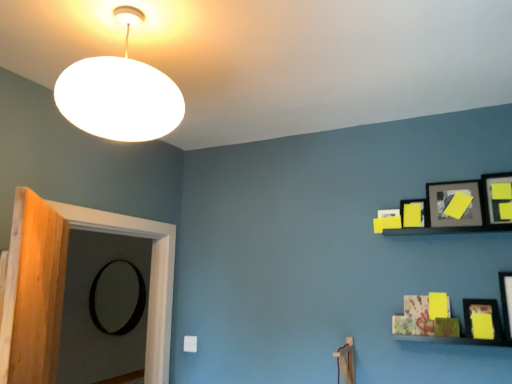
Question: Based on their positions, is wooden door at left located to the left or right of yellow matte picture frame at upper right, the 1th picture frame when ordered from top to bottom?

Choices:
 (A) left
 (B) right

Answer: (A)

Question: Considering their positions, is wooden door at left located in front of or behind yellow matte picture frame at upper right, acting as the 4th picture frame starting from the back?

Choices:
 (A) behind
 (B) front

Answer: (B)

Question: Which of these objects is positioned farthest from the black matte picture frame at left, the 6th picture frame viewed from the top?

Choices:
 (A) wooden door at left
 (B) yellow matte picture frame at lower right, the 5th picture frame when ordered from back to front
 (C) yellow matte picture frame at upper right, acting as the second picture frame starting from the top
 (D) matte black picture frame at right, the third picture frame ordered from the bottom
 (E) white matte lampshade at upper left

Answer: (D)

Question: Estimate the real-world distances between objects in this image. Which object is farther from the yellow matte picture frame at lower right, which is counted as the 5th picture frame, starting from the top?

Choices:
 (A) yellow matte picture frame at upper right, the third picture frame positioned from the back
 (B) white matte lampshade at upper left
 (C) matte black picture frame at upper right, the 2th picture frame positioned from the left
 (D) matte black picture frame at right, which is the sixth picture frame in back-to-front order
 (E) yellow matte picture frame at upper right, which is counted as the sixth picture frame, starting from the bottom

Answer: (B)